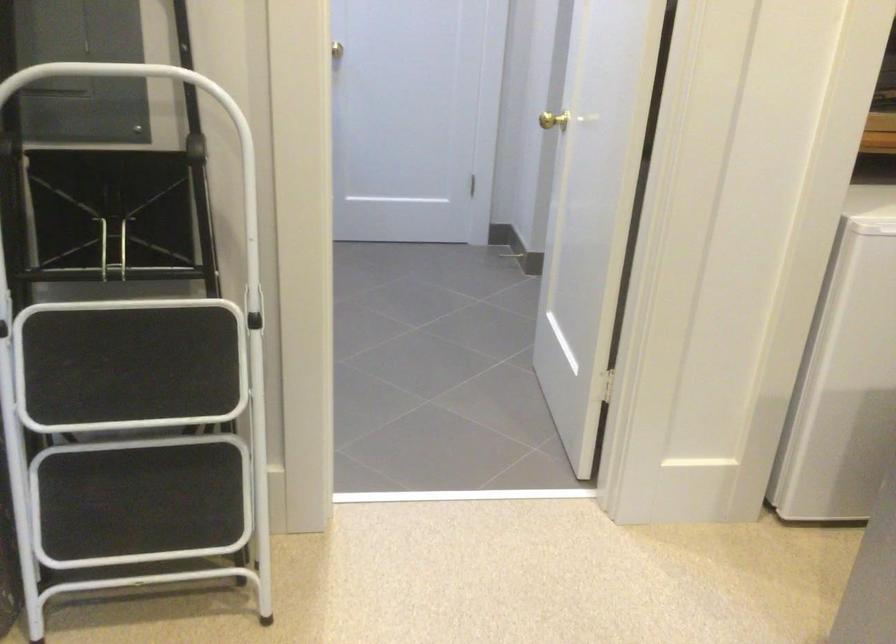
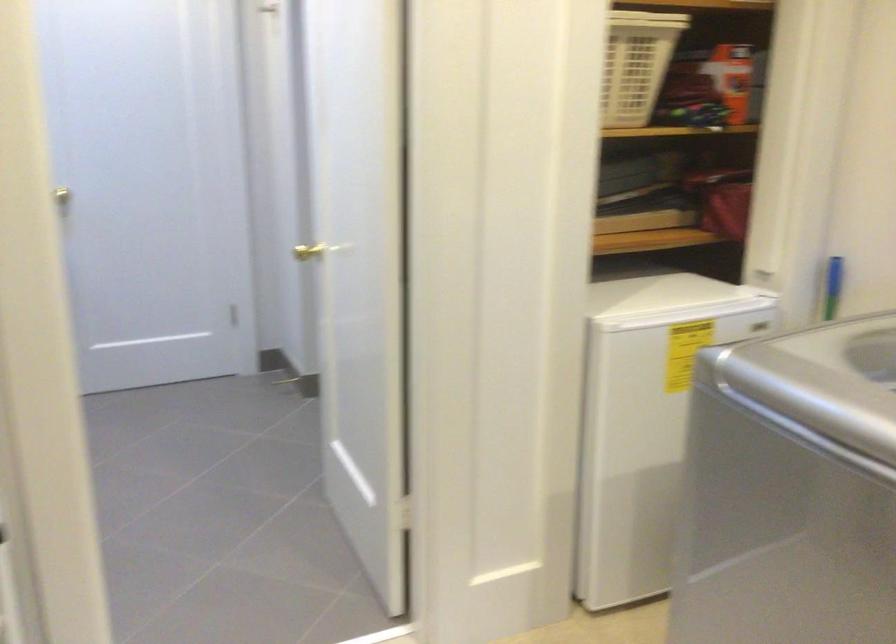
Question: The camera is either moving clockwise (left) or counter-clockwise (right) around the object. The first image is from the beginning of the video and the second image is from the end. Is the camera moving left or right when shooting the video?

Choices:
 (A) Left
 (B) Right

Answer: (A)